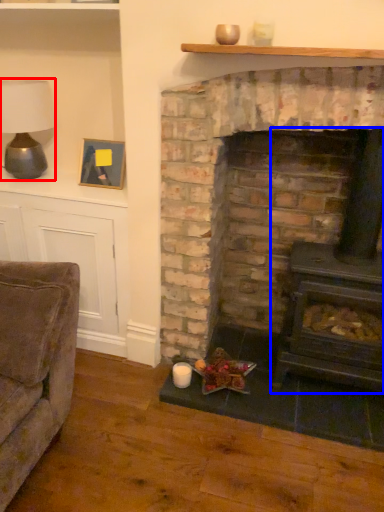
Question: Which point is further to the camera, table lamp (highlighted by a red box) or wood burning stove (highlighted by a blue box)?

Choices:
 (A) table lamp
 (B) wood burning stove

Answer: (A)